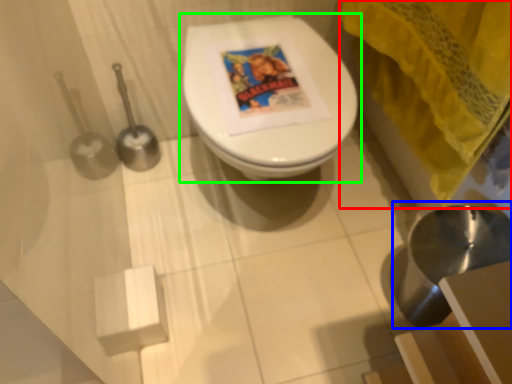
Question: Which object is the closest to the curtain (highlighted by a red box)? Choose among these: sink (highlighted by a blue box) or toilet (highlighted by a green box).

Choices:
 (A) sink
 (B) toilet

Answer: (B)